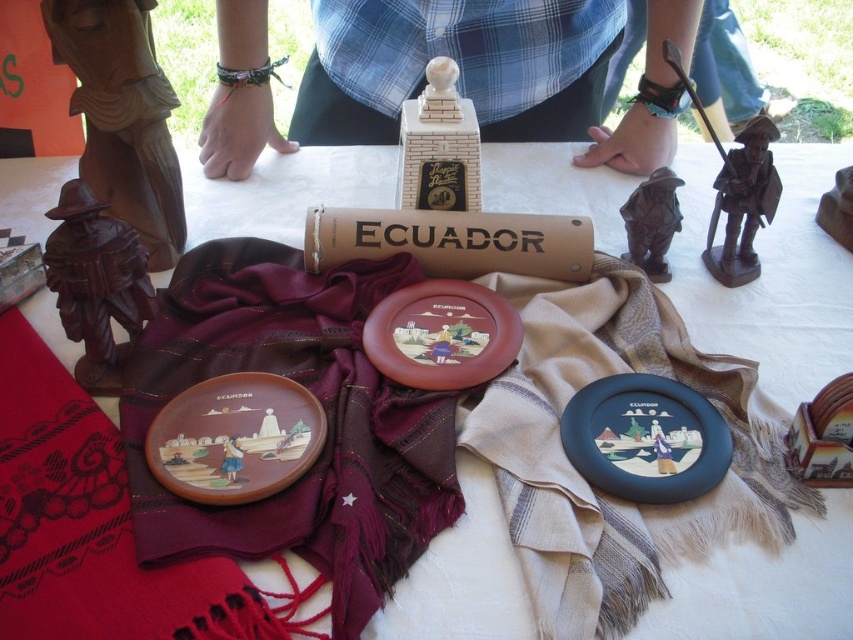
Question: Which point is closer to the camera?

Choices:
 (A) (64, 326)
 (B) (451, 374)

Answer: (B)

Question: Estimate the real-world distances between objects in this image. Which object is closer to the matte black platter at center?

Choices:
 (A) beige woven blanket at center
 (B) matte brown plate at center
 (C) red woven blanket at lower left

Answer: (A)

Question: Does red woven blanket at lower left appear on the right side of matte brown plate at center?

Choices:
 (A) no
 (B) yes

Answer: (A)

Question: Is the position of burgundy fabric at center less distant than that of brown wood statue at center?

Choices:
 (A) no
 (B) yes

Answer: (B)

Question: Is burgundy fabric at center to the right of beige woven blanket at center from the viewer's perspective?

Choices:
 (A) yes
 (B) no

Answer: (B)

Question: Which of these objects is positioned closest to the brown wood carving at left?

Choices:
 (A) beige woven blanket at center
 (B) matte black platter at center
 (C) matte brown plate at center
 (D) red woven blanket at lower left

Answer: (D)